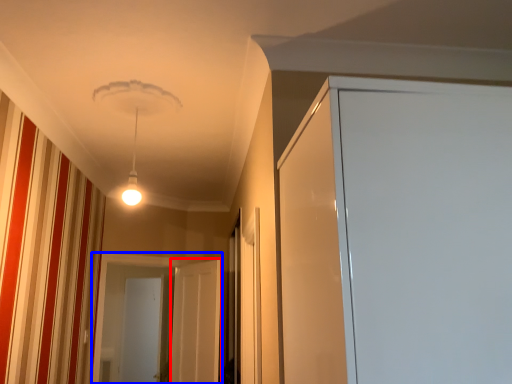
Question: Which point is closer to the camera, screen door (highlighted by a red box) or screen door (highlighted by a blue box)?

Choices:
 (A) screen door
 (B) screen door

Answer: (A)